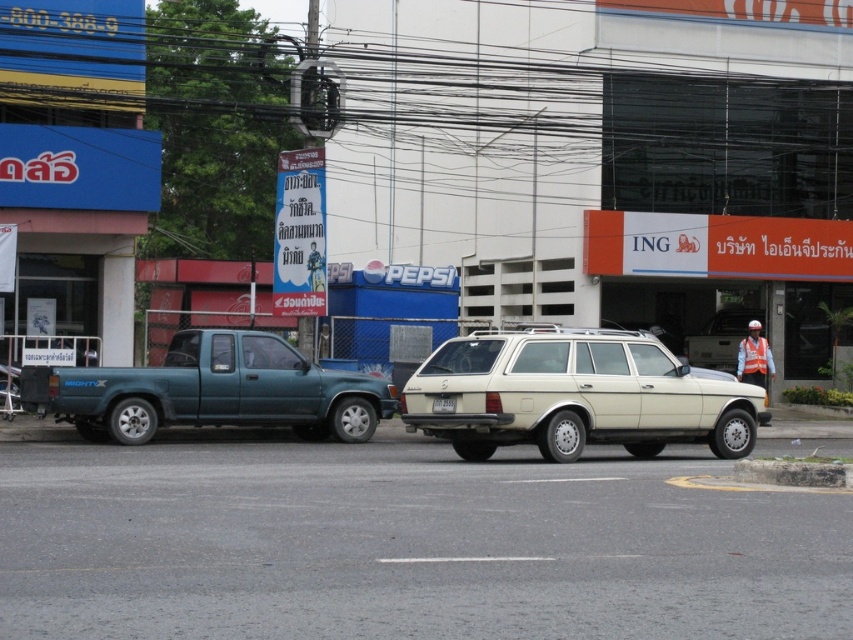
Can you confirm if beige matte station wagon at center is shorter than white plastic license plate at center?

In fact, beige matte station wagon at center may be taller than white plastic license plate at center.

Consider the image. Is beige matte station wagon at center bigger than white plastic license plate at center?

Correct, beige matte station wagon at center is larger in size than white plastic license plate at center.

The image size is (853, 640). In order to click on beige matte station wagon at center in this screenshot , I will do `click(575, 396)`.

The image size is (853, 640). What do you see at coordinates (215, 392) in the screenshot? I see `teal matte truck at left` at bounding box center [215, 392].

Is point (329, 376) less distant than point (434, 406)?

That is False.

Does point (379, 403) come farther from viewer compared to point (433, 408)?

Yes, point (379, 403) is farther from viewer.

This screenshot has height=640, width=853. I want to click on teal matte truck at left, so click(x=215, y=392).

Who is shorter, beige matte station wagon at center or teal matte truck at left?

beige matte station wagon at center

The height and width of the screenshot is (640, 853). In order to click on beige matte station wagon at center in this screenshot , I will do `click(575, 396)`.

This screenshot has height=640, width=853. In order to click on beige matte station wagon at center in this screenshot , I will do `click(575, 396)`.